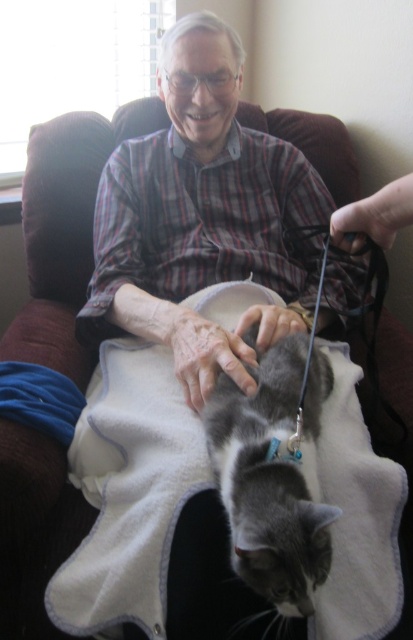
Does matte plaid shirt at center have a larger size compared to gray fur cat at center?

Indeed, matte plaid shirt at center has a larger size compared to gray fur cat at center.

The height and width of the screenshot is (640, 413). In order to click on matte plaid shirt at center in this screenshot , I will do (x=201, y=216).

Identify the location of matte plaid shirt at center. The width and height of the screenshot is (413, 640). (201, 216).